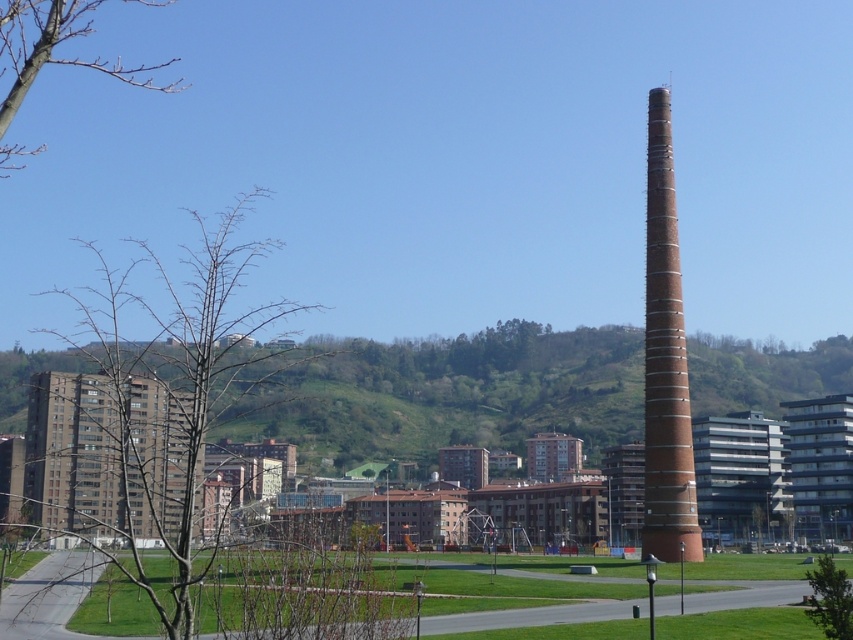
Question: Does bare branches at left have a larger size compared to brown brick building at left?

Choices:
 (A) yes
 (B) no

Answer: (A)

Question: Does brown brick building at left have a lesser width compared to brick tower at right?

Choices:
 (A) yes
 (B) no

Answer: (B)

Question: Which point appears closest to the camera in this image?

Choices:
 (A) (3, 28)
 (B) (659, 134)
 (C) (825, 593)

Answer: (A)

Question: Which of these objects is positioned farthest from the green leafy tree at lower right?

Choices:
 (A) bare branches at upper left
 (B) bare branches at left
 (C) brown brick building at left
 (D) brick tower at right

Answer: (A)

Question: Which of these objects is positioned closest to the brown brick building at left?

Choices:
 (A) brick tower at right
 (B) green leafy tree at lower right

Answer: (A)

Question: Does bare branches at left have a larger size compared to brown brick building at left?

Choices:
 (A) yes
 (B) no

Answer: (A)